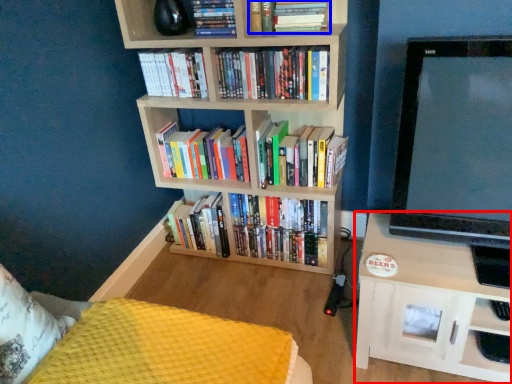
Question: Which point is further to the camera, shelf (highlighted by a red box) or book (highlighted by a blue box)?

Choices:
 (A) shelf
 (B) book

Answer: (B)